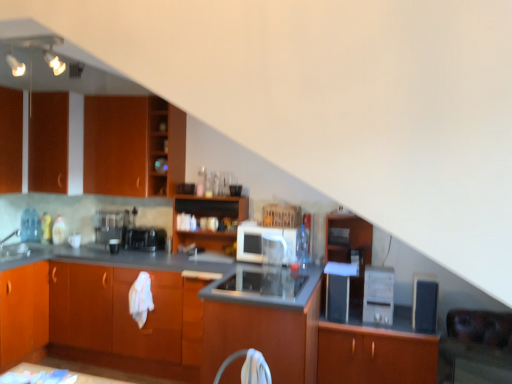
Question: Should I look upward or downward to see black plastic coffee maker at center, marked as the fifth appliance in a right-to-left arrangement?

Choices:
 (A) up
 (B) down

Answer: (B)

Question: Considering the relative sizes of white glossy microwave at center, the 3th appliance viewed from the left, and wooden shelves at center, which is the 3th cabinetry from right to left, in the image provided, is white glossy microwave at center, the 3th appliance viewed from the left, thinner than wooden shelves at center, which is the 3th cabinetry from right to left,?

Choices:
 (A) yes
 (B) no

Answer: (B)

Question: From the image's perspective, is white glossy microwave at center, the 3th appliance viewed from the left, below wooden shelves at center, the 6th cabinetry when ordered from left to right?

Choices:
 (A) no
 (B) yes

Answer: (B)

Question: Does white glossy microwave at center, the third appliance viewed from the right, have a larger size compared to wooden shelves at center, the 6th cabinetry when ordered from left to right?

Choices:
 (A) no
 (B) yes

Answer: (A)

Question: Is white glossy microwave at center, the third appliance viewed from the right, positioned with its back to wooden shelves at center, the 6th cabinetry when ordered from left to right?

Choices:
 (A) yes
 (B) no

Answer: (B)

Question: Is white glossy microwave at center, the third appliance viewed from the right, to the left of wooden shelves at center, which is the 3th cabinetry from right to left, from the viewer's perspective?

Choices:
 (A) no
 (B) yes

Answer: (A)

Question: Is white glossy microwave at center, the 3th appliance viewed from the left, oriented towards wooden shelves at center, which is the 3th cabinetry from right to left?

Choices:
 (A) no
 (B) yes

Answer: (A)

Question: Is wooden file cabinet at center in contact with matte black microwave at center, which ranks as the 1th appliance in right-to-left order?

Choices:
 (A) yes
 (B) no

Answer: (B)

Question: Would you say wooden file cabinet at center is a long distance from matte black microwave at center, acting as the fifth appliance starting from the left?

Choices:
 (A) yes
 (B) no

Answer: (B)

Question: Is wooden file cabinet at center looking in the opposite direction of matte black microwave at center, which ranks as the 1th appliance in right-to-left order?

Choices:
 (A) no
 (B) yes

Answer: (A)

Question: Is wooden file cabinet at center positioned in front of matte black microwave at center, acting as the fifth appliance starting from the left?

Choices:
 (A) yes
 (B) no

Answer: (B)

Question: Considering the relative sizes of wooden file cabinet at center and matte black microwave at center, which ranks as the 1th appliance in right-to-left order, in the image provided, is wooden file cabinet at center thinner than matte black microwave at center, which ranks as the 1th appliance in right-to-left order,?

Choices:
 (A) no
 (B) yes

Answer: (A)

Question: Is wooden file cabinet at center taller than matte black microwave at center, which ranks as the 1th appliance in right-to-left order?

Choices:
 (A) yes
 (B) no

Answer: (A)

Question: Can you confirm if wooden shelves at upper left is positioned to the right of white glossy microwave at center, the third appliance viewed from the right?

Choices:
 (A) yes
 (B) no

Answer: (B)